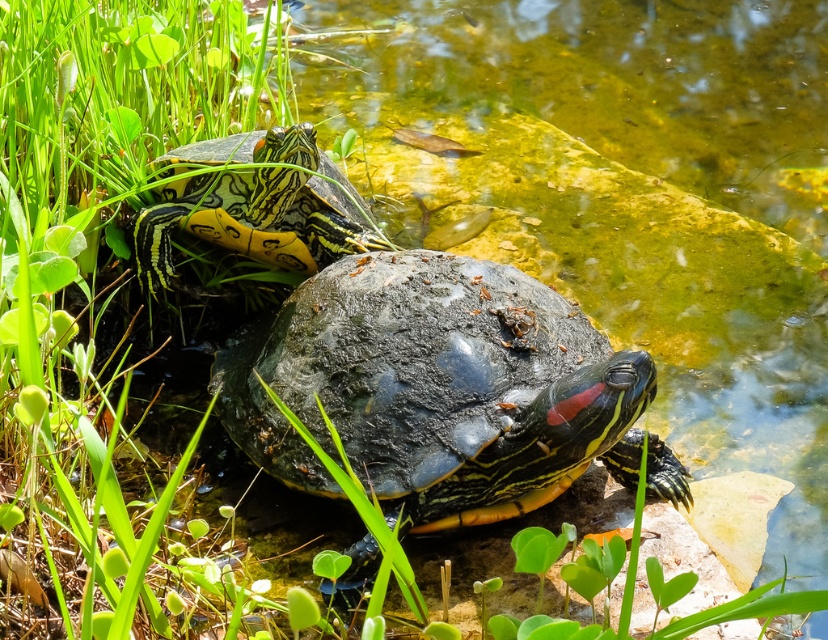
You are standing at the edge of the water and want to reach both points to observe the turtles. Which point, point (456,404) or point (301,218), is closer to you?

Point (456,404) is closer to the viewer than point (301,218).